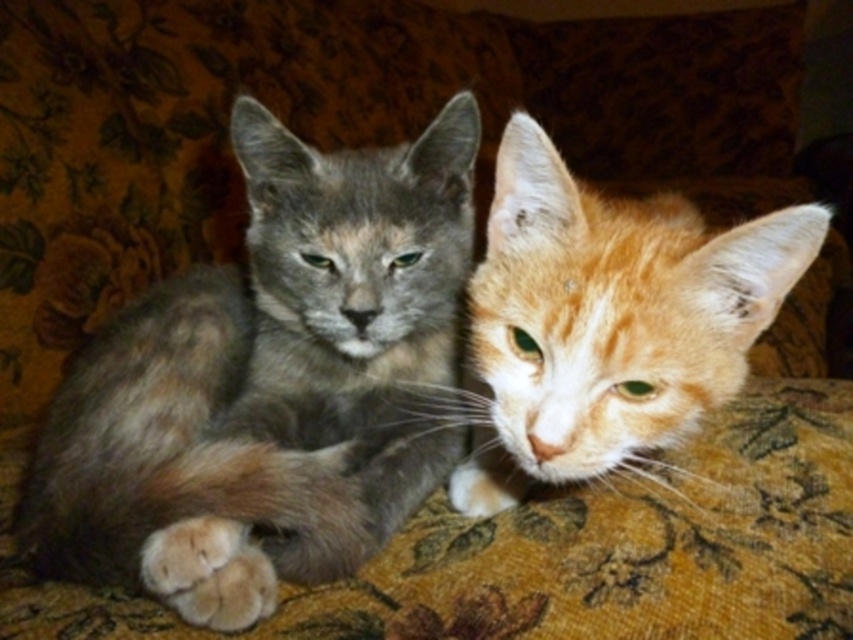
You are a photographer trying to capture both the gray fur cat at center and the orange fur cat at center in a single frame. If your camera can only focus on objects wider than 15 cm, which cat might require you to adjust your focus settings?

The gray fur cat at center has a greater width than the orange fur cat at center. Since the gray fur cat at center is wider, it is more likely to exceed the 15 cm focus limit, so you might need to adjust the focus settings for it.

You are a photographer trying to capture a clear photo of both the gray fur cat at center and the orange fur cat at center. Since you want both cats to be in focus, which one should you adjust your camera focus on first?

You should focus on the gray fur cat at center first because it is closer to the viewer than the orange fur cat at center, ensuring both will be in focus when focused on the closer one.